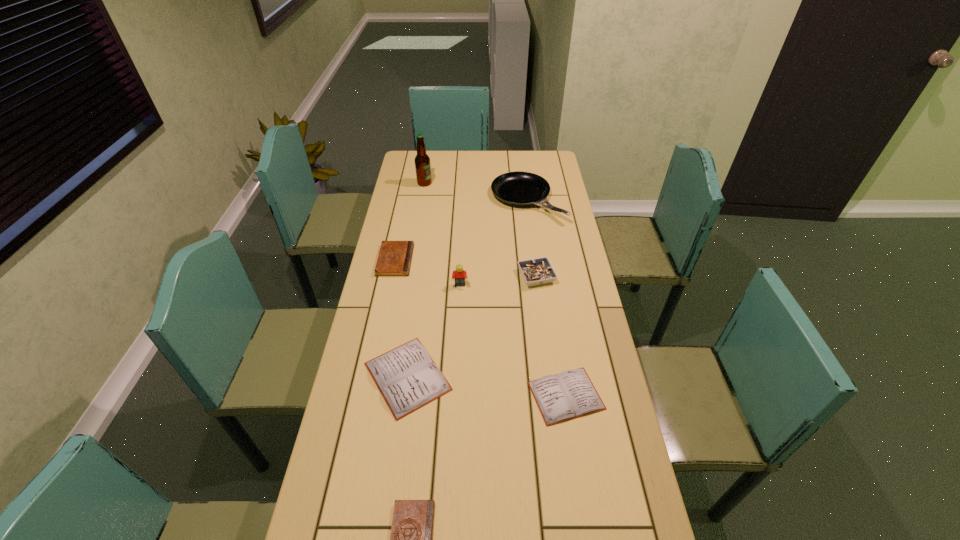
The height and width of the screenshot is (540, 960). I want to click on pan located at the right edge, so click(519, 188).

Identify the location of ashtray positioned at the right edge. The height and width of the screenshot is (540, 960). (539, 271).

At what (x,y) coordinates should I click in order to perform the action: click on diary at the right edge. Please return your answer as a coordinate pair (x, y). The height and width of the screenshot is (540, 960). Looking at the image, I should click on (570, 394).

I want to click on free region at the far edge of the desktop, so click(509, 151).

At what (x,y) coordinates should I click in order to perform the action: click on vacant area at the left edge. Please return your answer as a coordinate pair (x, y). The image size is (960, 540). Looking at the image, I should click on (419, 203).

I want to click on free location at the right edge of the desktop, so (x=547, y=293).

In the image, there is a desktop. At what (x,y) coordinates should I click in order to perform the action: click on vacant space at the far right corner. Please return your answer as a coordinate pair (x, y). The width and height of the screenshot is (960, 540). Looking at the image, I should click on (558, 166).

Locate an element on the screen. The height and width of the screenshot is (540, 960). free space between the black pan and the second tallest object is located at coordinates (493, 242).

Where is `free spot between the tallest object and the farther brown diary`? free spot between the tallest object and the farther brown diary is located at coordinates tap(410, 221).

The width and height of the screenshot is (960, 540). Identify the location of free space between the rightmost diary and the second tallest object. (513, 341).